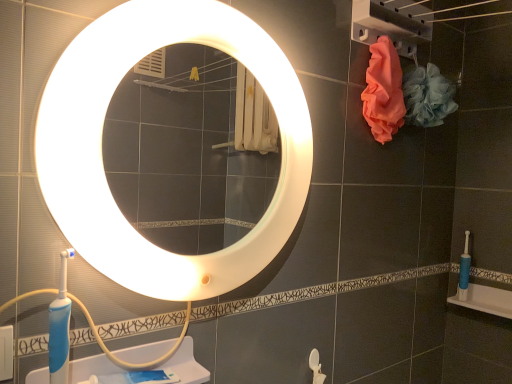
Describe the element at coordinates (101, 146) in the screenshot. This screenshot has height=384, width=512. I see `white glossy mirror at upper center` at that location.

Identify the location of blue plastic toothbrush at lower right. (464, 270).

Is white glossy mirror at upper center oriented away from blue plastic toothbrush at lower right?

white glossy mirror at upper center is not turned away from blue plastic toothbrush at lower right.

Between point (257, 49) and point (465, 261), which one is positioned behind?

Point (465, 261)

Identify the location of toothbrush located underneath the white glossy mirror at upper center (from a real-world perspective). (464, 270).

In the scene shown: From their relative heights in the image, would you say blue plastic toothbrush at lower right is taller or shorter than white glossy mirror at upper center?

Clearly, blue plastic toothbrush at lower right is shorter compared to white glossy mirror at upper center.

From the image's perspective, between blue plastic toothbrush at lower right and white glossy mirror at upper center, who is located below?

blue plastic toothbrush at lower right appears lower in the image.

Based on the photo, does blue plastic toothbrush at lower right appear on the right side of white glossy mirror at upper center?

Yes.

Consider the image. Can you tell me how much blue plastic toothbrush at lower right and white glossy mirror at upper center differ in facing direction?

87.9 degrees.

Is blue plastic toothbrush at lower right surrounding pink fabric at upper right?

Actually, pink fabric at upper right is outside blue plastic toothbrush at lower right.

Could you tell me if blue plastic toothbrush at lower right is facing pink fabric at upper right?

No, blue plastic toothbrush at lower right is not oriented towards pink fabric at upper right.

How many degrees apart are the facing directions of blue plastic toothbrush at lower right and pink fabric at upper right?

There is a 89.1-degree angle between the facing directions of blue plastic toothbrush at lower right and pink fabric at upper right.

Which object is closer to the camera taking this photo, blue plastic toothbrush at lower right or pink fabric at upper right?

pink fabric at upper right.

Considering the relative sizes of white plastic sink at lower left and white glossy mirror at upper center in the image provided, is white plastic sink at lower left bigger than white glossy mirror at upper center?

Incorrect, white plastic sink at lower left is not larger than white glossy mirror at upper center.

Is white plastic sink at lower left positioned with its back to white glossy mirror at upper center?

No, white plastic sink at lower left is not facing away from white glossy mirror at upper center.

Considering the positions of objects white plastic sink at lower left and white glossy mirror at upper center in the image provided, who is in front, white plastic sink at lower left or white glossy mirror at upper center?

white glossy mirror at upper center is closer to the camera.

In the scene shown: Is blue plastic toothbrush at lower right positioned behind white glossy mirror at upper center?

Yes, blue plastic toothbrush at lower right is further from the camera.

Considering the positions of points (453, 300) and (121, 46), is point (453, 300) closer to camera compared to point (121, 46)?

No, it is not.

Is blue plastic toothbrush at lower right next to white glossy mirror at upper center and touching it?

No, blue plastic toothbrush at lower right is not with white glossy mirror at upper center.

Does blue plastic toothbrush at lower right have a larger size compared to white glossy mirror at upper center?

No, blue plastic toothbrush at lower right is not bigger than white glossy mirror at upper center.

From a real-world perspective, which is physically below, pink fabric at upper right or blue plastic toothbrush at lower right?

From a 3D spatial view, blue plastic toothbrush at lower right is below.

Is pink fabric at upper right not close to blue plastic toothbrush at lower right?

No, pink fabric at upper right is in close proximity to blue plastic toothbrush at lower right.

Consider the image. In terms of width, does pink fabric at upper right look wider or thinner when compared to blue plastic toothbrush at lower right?

Clearly, pink fabric at upper right has less width compared to blue plastic toothbrush at lower right.

In the scene shown: Between blue plastic toothbrush at lower right and white plastic sink at lower left, which one is positioned behind?

blue plastic toothbrush at lower right is behind.

Which of these two, blue plastic toothbrush at lower right or white plastic sink at lower left, is thinner?

blue plastic toothbrush at lower right is thinner.

From a real-world perspective, is blue plastic toothbrush at lower right positioned above or below white plastic sink at lower left?

From a real-world perspective, blue plastic toothbrush at lower right is physically above white plastic sink at lower left.

Is blue plastic toothbrush at lower right positioned beyond the bounds of white plastic sink at lower left?

blue plastic toothbrush at lower right is positioned outside white plastic sink at lower left.

Locate an element on the screen. This screenshot has height=384, width=512. toothbrush on the right of the white glossy mirror at upper center is located at coordinates (464, 270).

The height and width of the screenshot is (384, 512). What are the coordinates of `mirror in front of the blue plastic toothbrush at lower right` in the screenshot? It's located at (101, 146).

Based on their spatial positions, is pink fabric at upper right or white glossy mirror at upper center closer to blue plastic toothbrush at lower right?

pink fabric at upper right lies closer to blue plastic toothbrush at lower right than the other object.

Based on their spatial positions, is white glossy mirror at upper center or white plastic sink at lower left further from pink fabric at upper right?

white plastic sink at lower left is further to pink fabric at upper right.

Based on the photo, when comparing their distances from white plastic sink at lower left, does blue plastic toothbrush at lower right or pink fabric at upper right seem closer?

pink fabric at upper right is positioned closer to the anchor white plastic sink at lower left.

Looking at this image, which object lies nearer to the anchor point blue plastic toothbrush at lower right, blue plastic toothbrush at lower right or white glossy mirror at upper center?

Among the two, blue plastic toothbrush at lower right is located nearer to blue plastic toothbrush at lower right.

Based on the photo, considering their positions, is blue plastic toothbrush at lower right positioned further to white glossy mirror at upper center than white plastic sink at lower left?

blue plastic toothbrush at lower right.

When comparing their distances from blue plastic toothbrush at lower right, does white glossy mirror at upper center or white plastic sink at lower left seem closer?

white glossy mirror at upper center.

From the image, which object appears to be farther from blue plastic toothbrush at lower right, white plastic sink at lower left or blue plastic toothbrush at lower right?

white plastic sink at lower left lies further to blue plastic toothbrush at lower right than the other object.

From the image, which object appears to be farther from blue plastic toothbrush at lower right, pink fabric at upper right or blue plastic toothbrush at lower right?

The object further to blue plastic toothbrush at lower right is pink fabric at upper right.

Where is `toothbrush between white glossy mirror at upper center and blue plastic toothbrush at lower right from left to right`? toothbrush between white glossy mirror at upper center and blue plastic toothbrush at lower right from left to right is located at coordinates (464, 270).

Identify the location of material located between white plastic sink at lower left and blue plastic toothbrush at lower right in the left-right direction. (383, 91).

The width and height of the screenshot is (512, 384). I want to click on mirror situated between white plastic sink at lower left and blue plastic toothbrush at lower right from left to right, so click(x=101, y=146).

Identify the location of toothbrush between pink fabric at upper right and blue plastic toothbrush at lower right vertically. (464, 270).